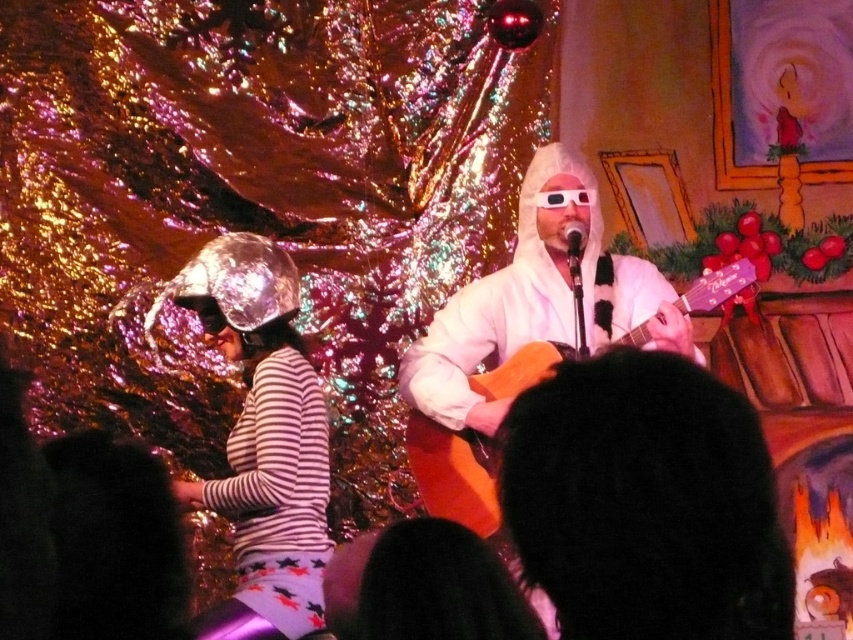
Looking at this image, which is above, matte orange acoustic guitar at center or metallic silver microphone at center?

metallic silver microphone at center

Who is more forward, (457, 497) or (581, 240)?

Positioned in front is point (457, 497).

Locate an element on the screen. Image resolution: width=853 pixels, height=640 pixels. matte orange acoustic guitar at center is located at coordinates (454, 472).

Can you confirm if black fuzzy hat at center is wider than metallic silver microphone at center?

Yes.

Locate an element on the screen. Image resolution: width=853 pixels, height=640 pixels. black fuzzy hat at center is located at coordinates (645, 502).

Between point (605, 577) and point (569, 272), which one is positioned behind?

Point (569, 272)

Locate an element on the screen. This screenshot has width=853, height=640. black fuzzy hat at center is located at coordinates (645, 502).

The height and width of the screenshot is (640, 853). What do you see at coordinates (262, 440) in the screenshot?
I see `shiny metallic helmet at left` at bounding box center [262, 440].

Which is behind, point (260, 342) or point (573, 225)?

The point (573, 225) is more distant.

Is point (259, 508) closer to viewer compared to point (573, 259)?

Yes.

Identify the location of shiny metallic helmet at left. (x=262, y=440).